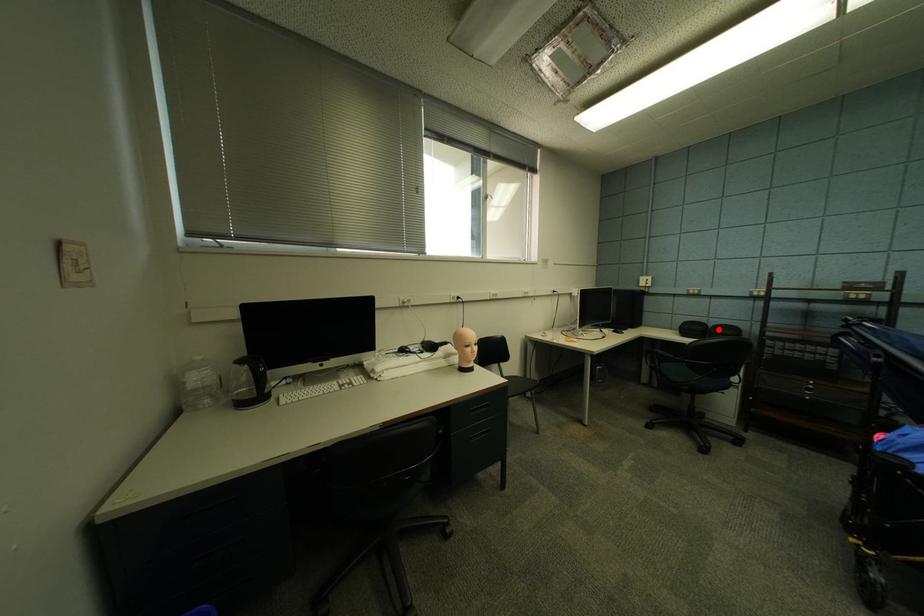
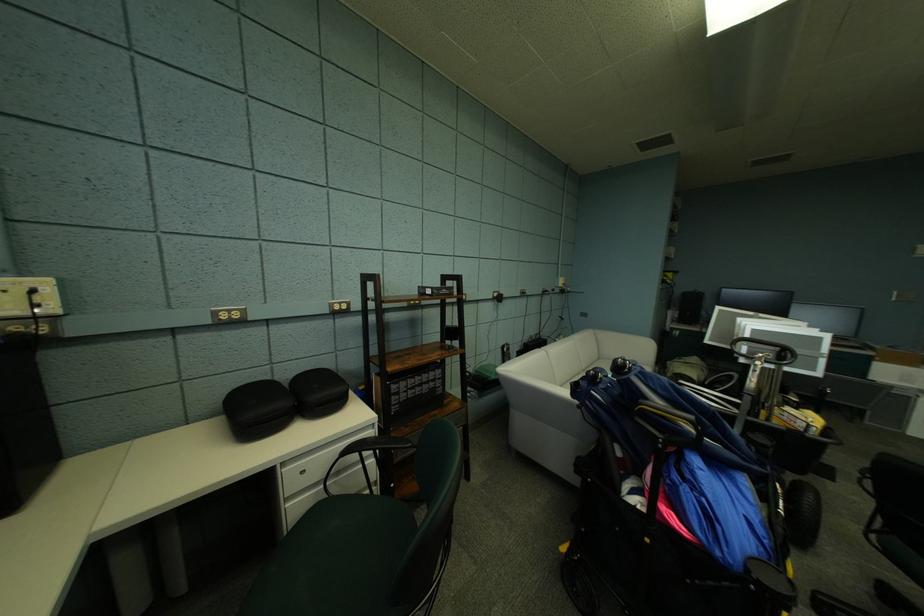
Locate, in the second image, the point that corresponds to the highlighted location in the first image.

(297, 389)